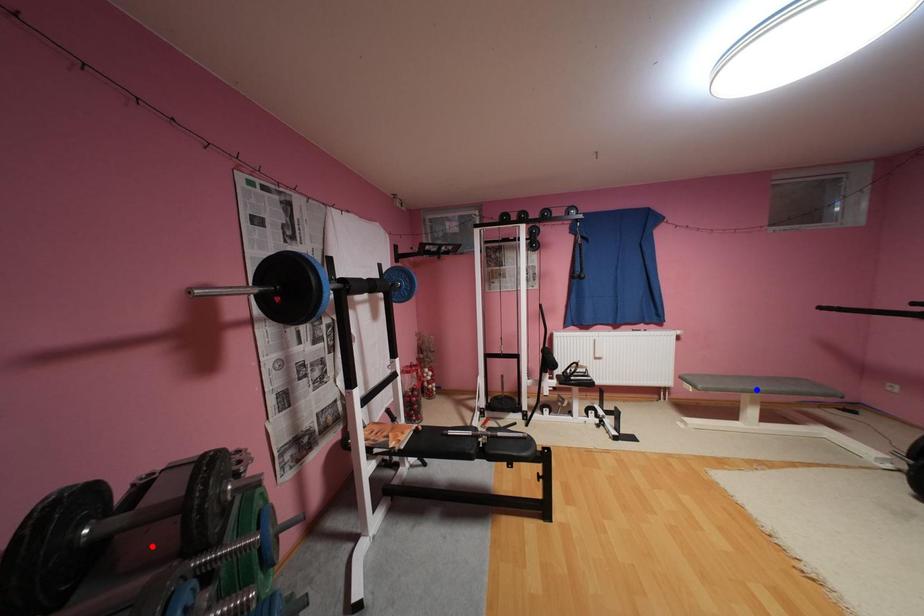
Question: Which of the two points in the image is closer to the camera?

Choices:
 (A) Blue point is closer.
 (B) Red point is closer.

Answer: (B)